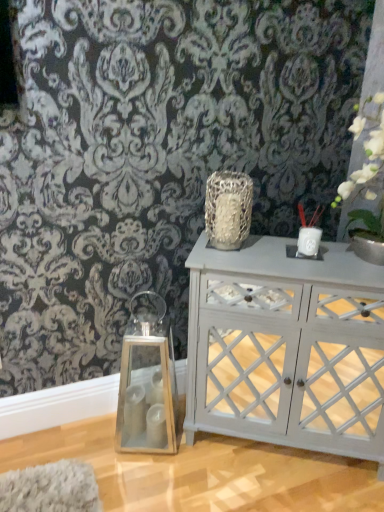
Where is `spots to the right of clear glass lantern at left, the third candle holder from the top`? The height and width of the screenshot is (512, 384). spots to the right of clear glass lantern at left, the third candle holder from the top is located at coordinates (210, 457).